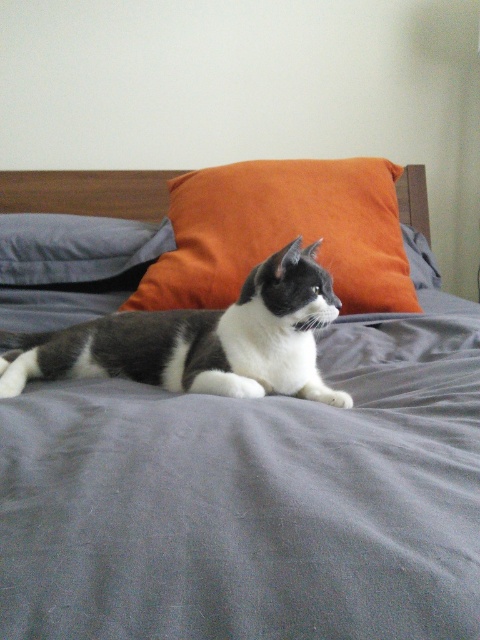
Question: Does orange fabric pillow at center have a lesser width compared to matte gray pillow at left?

Choices:
 (A) yes
 (B) no

Answer: (B)

Question: Does orange fabric pillow at center have a smaller size compared to black-and-white fur cat at center?

Choices:
 (A) yes
 (B) no

Answer: (B)

Question: Which of these objects is positioned farthest from the gray fabric bed at center?

Choices:
 (A) black-and-white fur cat at center
 (B) orange fabric pillow at center
 (C) matte gray pillow at left

Answer: (C)

Question: Considering the relative positions of gray fabric bed at center and matte gray pillow at left in the image provided, where is gray fabric bed at center located with respect to matte gray pillow at left?

Choices:
 (A) below
 (B) above

Answer: (A)

Question: Which is nearer to the matte gray pillow at left?

Choices:
 (A) gray fabric bed at center
 (B) black-and-white fur cat at center
 (C) orange fabric pillow at center

Answer: (C)

Question: Estimate the real-world distances between objects in this image. Which object is closer to the orange fabric pillow at center?

Choices:
 (A) gray fabric bed at center
 (B) black-and-white fur cat at center
 (C) matte gray pillow at left

Answer: (C)